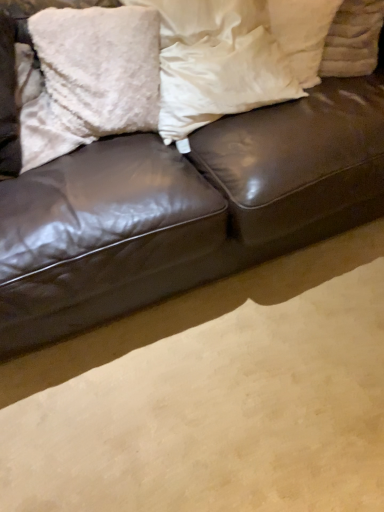
Locate an element on the screen. The height and width of the screenshot is (512, 384). shiny brown leather couch at center is located at coordinates (183, 209).

Identify the location of white soft pillow at center, the second pillow in the right-to-left sequence. (220, 76).

This screenshot has width=384, height=512. Find the location of `fluffy white pillow at upper left, which ranks as the 3th pillow in right-to-left order`. fluffy white pillow at upper left, which ranks as the 3th pillow in right-to-left order is located at coordinates (89, 79).

The height and width of the screenshot is (512, 384). In order to click on white fluffy pillow at upper right, which is the 1th pillow in right-to-left order in this screenshot , I will do `click(302, 34)`.

Find the location of `shiny brown leather couch at center`. shiny brown leather couch at center is located at coordinates (183, 209).

Is white fluffy pillow at upper right, positioned as the 3th pillow in left-to-right order, to the left of fluffy white pillow at upper left, arranged as the first pillow when viewed from the left, from the viewer's perspective?

No, white fluffy pillow at upper right, positioned as the 3th pillow in left-to-right order, is not to the left of fluffy white pillow at upper left, arranged as the first pillow when viewed from the left.

Does white fluffy pillow at upper right, which is the 1th pillow in right-to-left order, have a smaller size compared to fluffy white pillow at upper left, which ranks as the 3th pillow in right-to-left order?

Indeed, white fluffy pillow at upper right, which is the 1th pillow in right-to-left order, has a smaller size compared to fluffy white pillow at upper left, which ranks as the 3th pillow in right-to-left order.

How different are the orientations of white fluffy pillow at upper right, which is the 1th pillow in right-to-left order, and fluffy white pillow at upper left, which ranks as the 3th pillow in right-to-left order, in degrees?

The angle between the facing direction of white fluffy pillow at upper right, which is the 1th pillow in right-to-left order, and the facing direction of fluffy white pillow at upper left, which ranks as the 3th pillow in right-to-left order, is 33.5 degrees.

Which of these two, white fluffy pillow at upper right, positioned as the 3th pillow in left-to-right order, or fluffy white pillow at upper left, which ranks as the 3th pillow in right-to-left order, is thinner?

fluffy white pillow at upper left, which ranks as the 3th pillow in right-to-left order, is thinner.

The image size is (384, 512). Find the location of `studio couch that is in front of the white fluffy pillow at upper right, which is the 1th pillow in right-to-left order`. studio couch that is in front of the white fluffy pillow at upper right, which is the 1th pillow in right-to-left order is located at coordinates (183, 209).

From the image's perspective, is white fluffy pillow at upper right, positioned as the 3th pillow in left-to-right order, located above or below shiny brown leather couch at center?

white fluffy pillow at upper right, positioned as the 3th pillow in left-to-right order, is above shiny brown leather couch at center.

Considering the relative sizes of white fluffy pillow at upper right, which is the 1th pillow in right-to-left order, and shiny brown leather couch at center in the image provided, is white fluffy pillow at upper right, which is the 1th pillow in right-to-left order, shorter than shiny brown leather couch at center?

Correct, white fluffy pillow at upper right, which is the 1th pillow in right-to-left order, is not as tall as shiny brown leather couch at center.

Is white fluffy pillow at upper right, positioned as the 3th pillow in left-to-right order, located outside shiny brown leather couch at center?

No, white fluffy pillow at upper right, positioned as the 3th pillow in left-to-right order, is not outside of shiny brown leather couch at center.

Which object is thinner, white soft pillow at center, the second pillow in the right-to-left sequence, or fluffy white pillow at upper left, which ranks as the 3th pillow in right-to-left order?

Thinner between the two is fluffy white pillow at upper left, which ranks as the 3th pillow in right-to-left order.

How much distance is there between white soft pillow at center, the second pillow in the right-to-left sequence, and fluffy white pillow at upper left, arranged as the first pillow when viewed from the left?

white soft pillow at center, the second pillow in the right-to-left sequence, is 7.95 inches from fluffy white pillow at upper left, arranged as the first pillow when viewed from the left.

Is white soft pillow at center, the 2th pillow viewed from the left, bigger or smaller than fluffy white pillow at upper left, arranged as the first pillow when viewed from the left?

white soft pillow at center, the 2th pillow viewed from the left, is bigger than fluffy white pillow at upper left, arranged as the first pillow when viewed from the left.

From the picture: From a real-world perspective, is white soft pillow at center, the 2th pillow viewed from the left, under fluffy white pillow at upper left, arranged as the first pillow when viewed from the left?

No.

From the image's perspective, is shiny brown leather couch at center located above white fluffy pillow at upper right, which is the 1th pillow in right-to-left order?

Incorrect, from the image's perspective, shiny brown leather couch at center is lower than white fluffy pillow at upper right, which is the 1th pillow in right-to-left order.

From the picture: Would you consider shiny brown leather couch at center to be distant from white fluffy pillow at upper right, which is the 1th pillow in right-to-left order?

That's not correct — shiny brown leather couch at center is a little close to white fluffy pillow at upper right, which is the 1th pillow in right-to-left order.

Is shiny brown leather couch at center in front of or behind white fluffy pillow at upper right, positioned as the 3th pillow in left-to-right order, in the image?

Clearly, shiny brown leather couch at center is in front of white fluffy pillow at upper right, positioned as the 3th pillow in left-to-right order.

Is shiny brown leather couch at center taller than white fluffy pillow at upper right, which is the 1th pillow in right-to-left order?

Indeed, shiny brown leather couch at center has a greater height compared to white fluffy pillow at upper right, which is the 1th pillow in right-to-left order.

Which is nearer, (172, 170) or (204, 49)?

Positioned in front is point (172, 170).

From a real-world perspective, between shiny brown leather couch at center and white soft pillow at center, the second pillow in the right-to-left sequence, who is vertically higher?

white soft pillow at center, the second pillow in the right-to-left sequence.

Which of these two, shiny brown leather couch at center or white soft pillow at center, the 2th pillow viewed from the left, stands taller?

shiny brown leather couch at center is taller.

Which object is further away from the camera taking this photo, shiny brown leather couch at center or white soft pillow at center, the 2th pillow viewed from the left?

white soft pillow at center, the 2th pillow viewed from the left, is further away from the camera.

From a real-world perspective, which is physically above, fluffy white pillow at upper left, which ranks as the 3th pillow in right-to-left order, or white soft pillow at center, the second pillow in the right-to-left sequence?

white soft pillow at center, the second pillow in the right-to-left sequence.

Looking at this image, is fluffy white pillow at upper left, arranged as the first pillow when viewed from the left, oriented away from white soft pillow at center, the second pillow in the right-to-left sequence?

fluffy white pillow at upper left, arranged as the first pillow when viewed from the left, is not turned away from white soft pillow at center, the second pillow in the right-to-left sequence.

Considering the sizes of objects fluffy white pillow at upper left, arranged as the first pillow when viewed from the left, and white soft pillow at center, the second pillow in the right-to-left sequence, in the image provided, who is shorter, fluffy white pillow at upper left, arranged as the first pillow when viewed from the left, or white soft pillow at center, the second pillow in the right-to-left sequence,?

fluffy white pillow at upper left, arranged as the first pillow when viewed from the left.

Considering their positions, is fluffy white pillow at upper left, which ranks as the 3th pillow in right-to-left order, located in front of or behind white soft pillow at center, the second pillow in the right-to-left sequence?

Visually, fluffy white pillow at upper left, which ranks as the 3th pillow in right-to-left order, is located behind white soft pillow at center, the second pillow in the right-to-left sequence.

Is point (149, 154) positioned behind point (64, 59)?

That is False.

From a real-world perspective, is shiny brown leather couch at center on top of fluffy white pillow at upper left, arranged as the first pillow when viewed from the left?

No, from a real-world perspective, shiny brown leather couch at center is not above fluffy white pillow at upper left, arranged as the first pillow when viewed from the left.

Between shiny brown leather couch at center and fluffy white pillow at upper left, which ranks as the 3th pillow in right-to-left order, which one has smaller size?

fluffy white pillow at upper left, which ranks as the 3th pillow in right-to-left order, is smaller.

Identify the location of the 2nd pillow below the white fluffy pillow at upper right, which is the 1th pillow in right-to-left order (from the image's perspective). 89,79.

Locate an element on the screen. Image resolution: width=384 pixels, height=512 pixels. studio couch located underneath the white fluffy pillow at upper right, positioned as the 3th pillow in left-to-right order (from a real-world perspective) is located at coordinates (183, 209).

Which object lies nearer to the anchor point white soft pillow at center, the 2th pillow viewed from the left, shiny brown leather couch at center or white fluffy pillow at upper right, which is the 1th pillow in right-to-left order?

Based on the image, white fluffy pillow at upper right, which is the 1th pillow in right-to-left order, appears to be nearer to white soft pillow at center, the 2th pillow viewed from the left.

Considering their positions, is shiny brown leather couch at center positioned closer to fluffy white pillow at upper left, which ranks as the 3th pillow in right-to-left order, than white fluffy pillow at upper right, which is the 1th pillow in right-to-left order?

Based on the image, shiny brown leather couch at center appears to be nearer to fluffy white pillow at upper left, which ranks as the 3th pillow in right-to-left order.

When comparing their distances from shiny brown leather couch at center, does white soft pillow at center, the second pillow in the right-to-left sequence, or fluffy white pillow at upper left, which ranks as the 3th pillow in right-to-left order, seem closer?

The object closer to shiny brown leather couch at center is white soft pillow at center, the second pillow in the right-to-left sequence.

Based on their spatial positions, is fluffy white pillow at upper left, which ranks as the 3th pillow in right-to-left order, or shiny brown leather couch at center further from white fluffy pillow at upper right, which is the 1th pillow in right-to-left order?

The object further to white fluffy pillow at upper right, which is the 1th pillow in right-to-left order, is fluffy white pillow at upper left, which ranks as the 3th pillow in right-to-left order.

Looking at the image, which one is located further to white fluffy pillow at upper right, which is the 1th pillow in right-to-left order, white soft pillow at center, the second pillow in the right-to-left sequence, or fluffy white pillow at upper left, which ranks as the 3th pillow in right-to-left order?

The object further to white fluffy pillow at upper right, which is the 1th pillow in right-to-left order, is fluffy white pillow at upper left, which ranks as the 3th pillow in right-to-left order.

Looking at the image, which one is located closer to white fluffy pillow at upper right, positioned as the 3th pillow in left-to-right order, fluffy white pillow at upper left, which ranks as the 3th pillow in right-to-left order, or white soft pillow at center, the second pillow in the right-to-left sequence?

The object closer to white fluffy pillow at upper right, positioned as the 3th pillow in left-to-right order, is white soft pillow at center, the second pillow in the right-to-left sequence.

Looking at the image, which one is located further to shiny brown leather couch at center, fluffy white pillow at upper left, which ranks as the 3th pillow in right-to-left order, or white soft pillow at center, the 2th pillow viewed from the left?

The object further to shiny brown leather couch at center is fluffy white pillow at upper left, which ranks as the 3th pillow in right-to-left order.

When comparing their distances from fluffy white pillow at upper left, which ranks as the 3th pillow in right-to-left order, does shiny brown leather couch at center or white soft pillow at center, the 2th pillow viewed from the left, seem further?

shiny brown leather couch at center.

In order to click on pillow located between shiny brown leather couch at center and fluffy white pillow at upper left, which ranks as the 3th pillow in right-to-left order, in the depth direction in this screenshot , I will do [x=220, y=76].

Identify the location of pillow between fluffy white pillow at upper left, arranged as the first pillow when viewed from the left, and white fluffy pillow at upper right, which is the 1th pillow in right-to-left order. (220, 76).